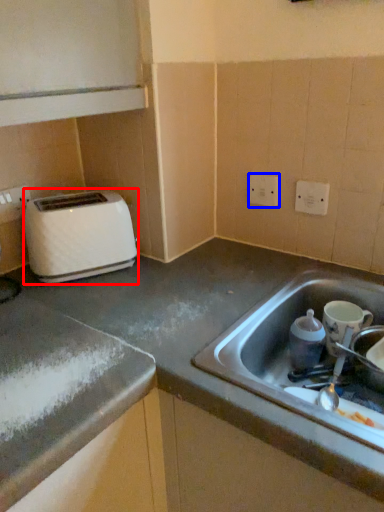
Question: Among these objects, which one is farthest to the camera, toaster (highlighted by a red box) or electric outlet (highlighted by a blue box)?

Choices:
 (A) toaster
 (B) electric outlet

Answer: (B)